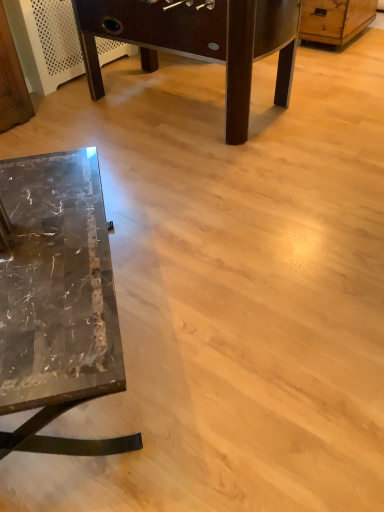
The height and width of the screenshot is (512, 384). What are the coordinates of `free location above marble table at lower left, which is the 2th table in top-to-bottom order (from a real-world perspective)` in the screenshot? It's located at (39, 242).